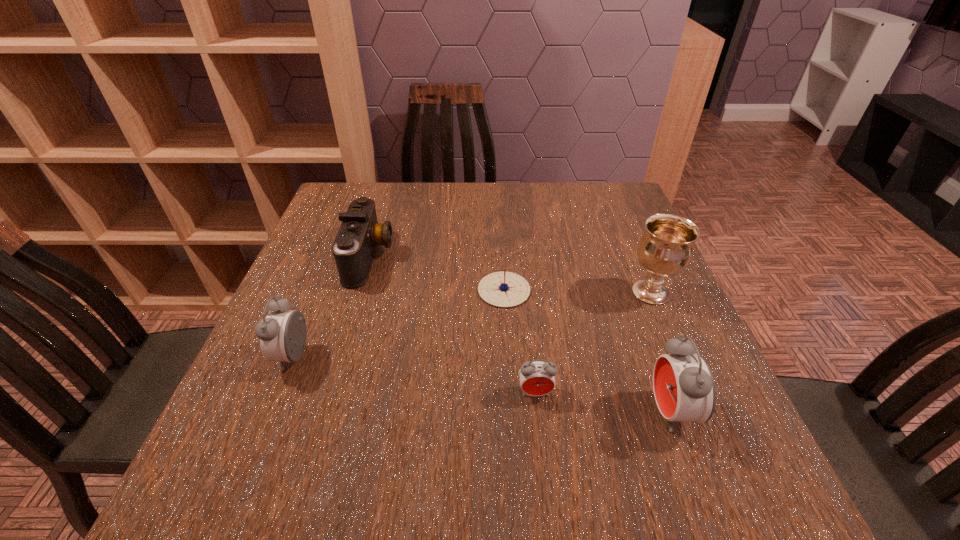
The image size is (960, 540). Identify the location of free point located on the face of the rightmost alarm clock. (482, 412).

Where is `vacant region located on the face of the rightmost alarm clock`? vacant region located on the face of the rightmost alarm clock is located at coordinates (567, 412).

Where is `vacant space situated on the face of the rightmost alarm clock`? The height and width of the screenshot is (540, 960). vacant space situated on the face of the rightmost alarm clock is located at coordinates (482, 412).

Locate an element on the screen. blank space located on the lens of the fifth object from right to left is located at coordinates (519, 257).

Where is `free region located on the back of the compass`? The height and width of the screenshot is (540, 960). free region located on the back of the compass is located at coordinates point(500,232).

Where is `vacant space located on the left of the chalice`? The width and height of the screenshot is (960, 540). vacant space located on the left of the chalice is located at coordinates (584, 293).

I want to click on alarm clock located in the left edge section of the desktop, so click(282, 334).

The height and width of the screenshot is (540, 960). Find the location of `camera present at the left edge`. camera present at the left edge is located at coordinates (354, 248).

This screenshot has height=540, width=960. Find the location of `alarm clock present at the right edge`. alarm clock present at the right edge is located at coordinates (684, 388).

Identify the location of chalice present at the right edge. (665, 249).